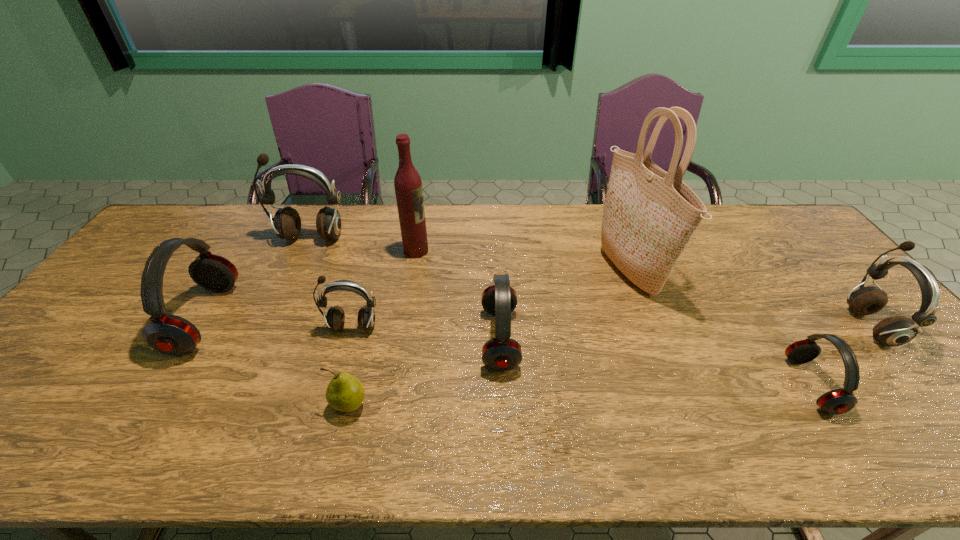
Where is `the fourth object from right to left`? The height and width of the screenshot is (540, 960). the fourth object from right to left is located at coordinates (502, 353).

Locate an element on the screen. This screenshot has height=540, width=960. the smallest brown earphone is located at coordinates (335, 318).

Locate an element on the screen. the third earphone from left to right is located at coordinates (335, 318).

Locate an element on the screen. This screenshot has width=960, height=540. the second shortest object is located at coordinates (838, 401).

At what (x,y) coordinates should I click in order to perform the action: click on the rightmost red earphone. Please return your answer as a coordinate pair (x, y). This screenshot has width=960, height=540. Looking at the image, I should click on (838, 401).

Where is `pear`? Image resolution: width=960 pixels, height=540 pixels. pear is located at coordinates (345, 393).

Where is `vacant space situated 0.140m on the left of the shopping bag`? The image size is (960, 540). vacant space situated 0.140m on the left of the shopping bag is located at coordinates (556, 272).

Identify the location of vacant space situated 0.100m on the label of the liquor. The image size is (960, 540). (460, 251).

Locate an element on the screen. This screenshot has width=960, height=540. free point located 0.060m on the ear pads of the tallest earphone is located at coordinates (300, 260).

Find the location of `vacant space located on the ear cups of the leftmost red earphone`. vacant space located on the ear cups of the leftmost red earphone is located at coordinates (337, 319).